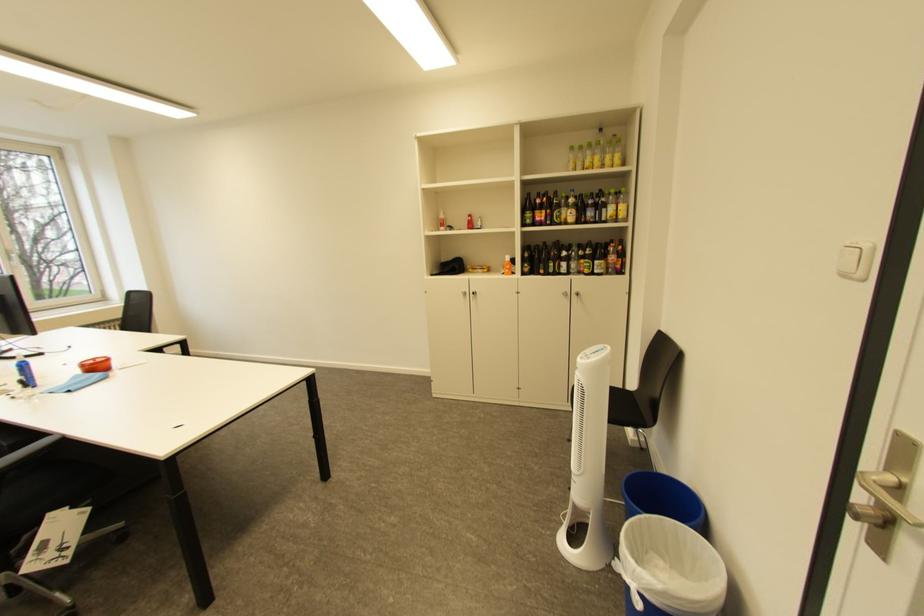
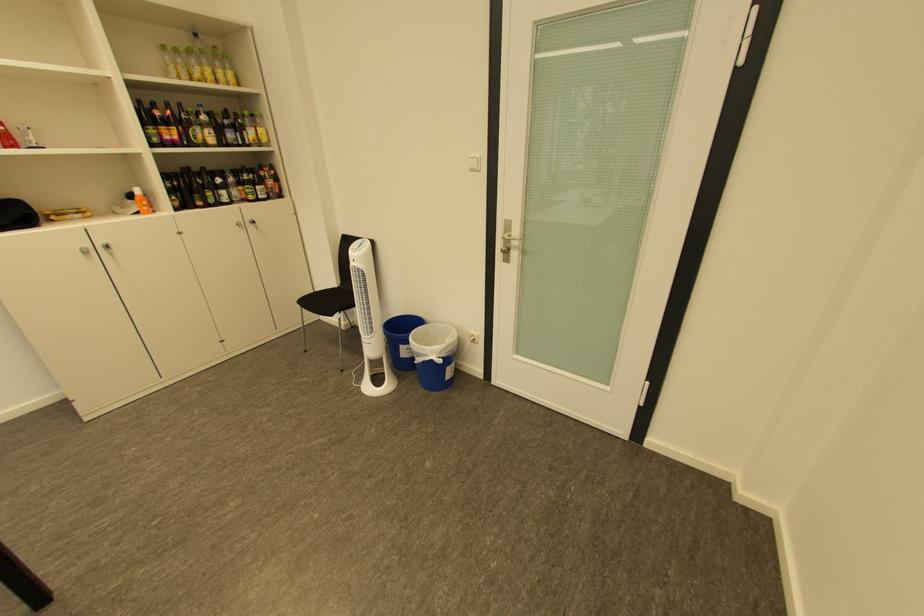
Find the pixel in the second image that matches pixel 514 274 in the first image.

(148, 214)